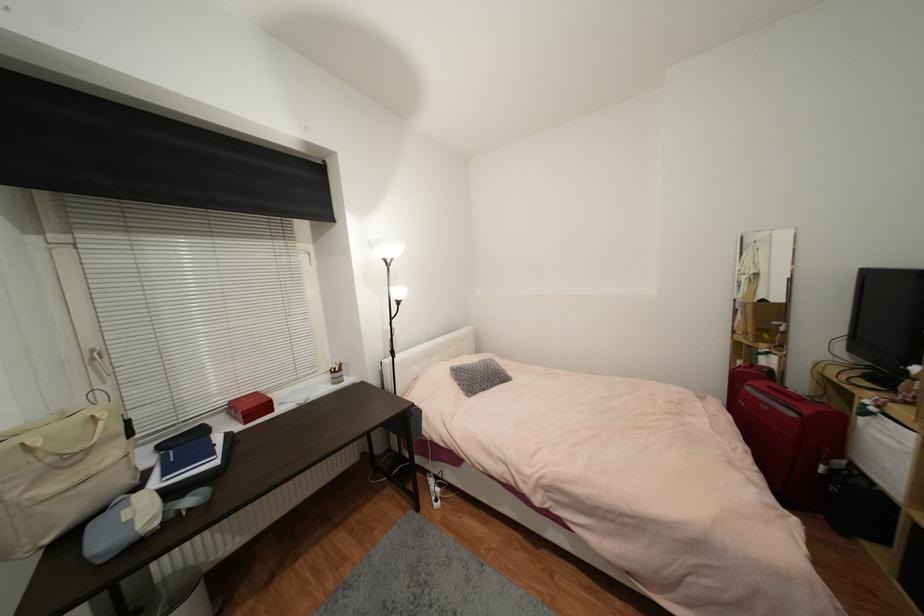
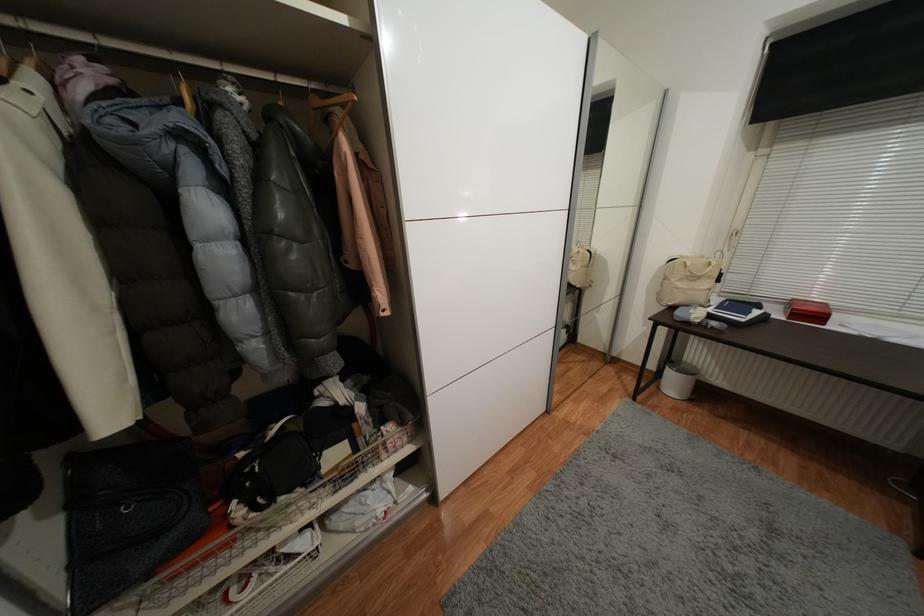
Where in the second image is the point corresponding to point (272, 408) from the first image?

(824, 318)